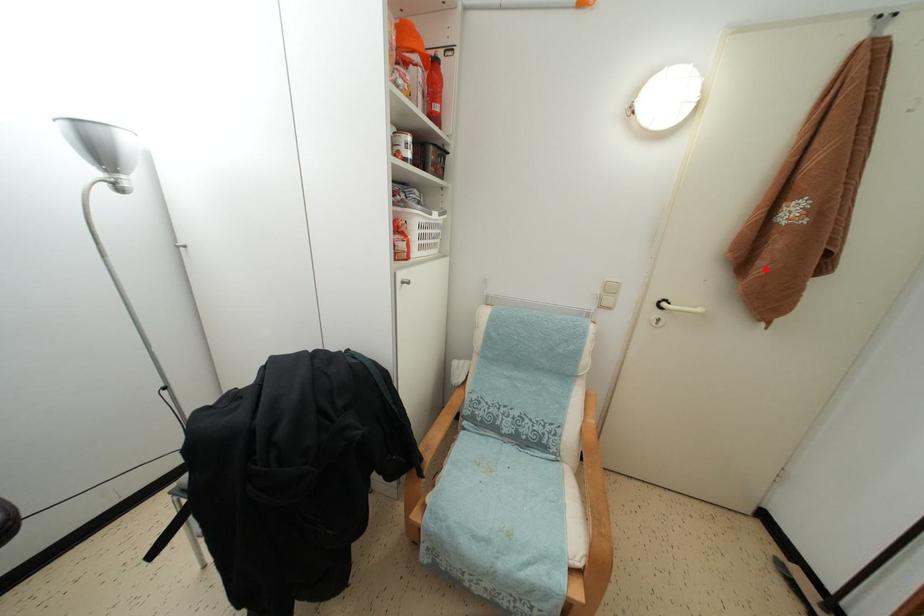
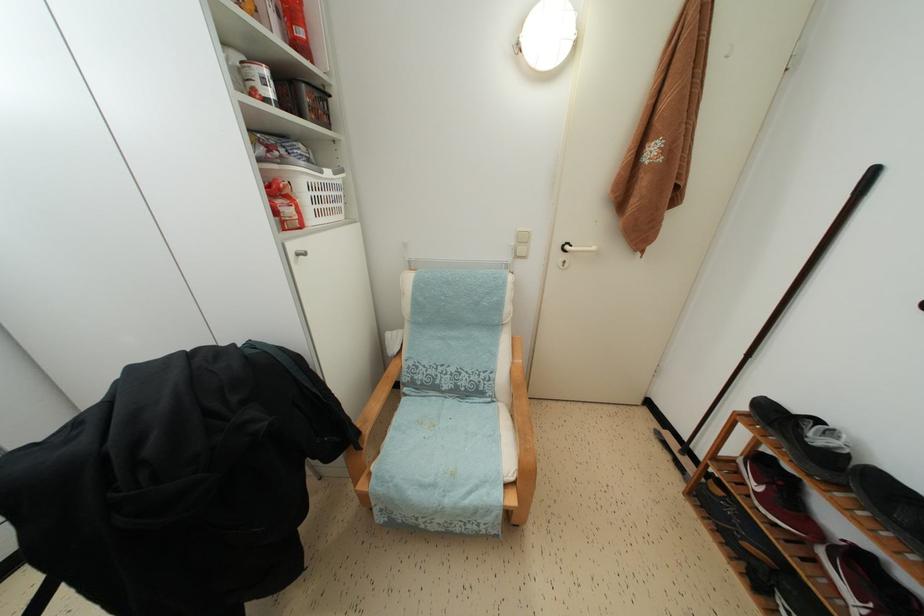
Locate, in the second image, the point that corresponds to the highlighted location in the first image.

(638, 207)